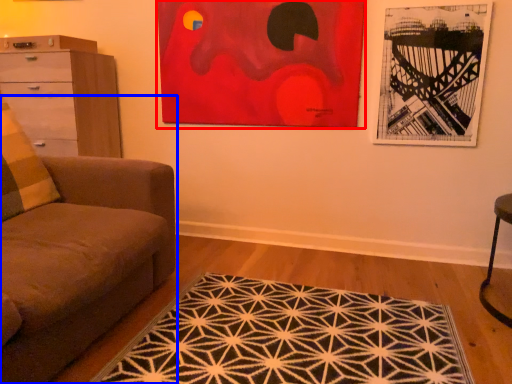
Question: Which object appears farthest to the camera in this image, picture frame (highlighted by a red box) or studio couch (highlighted by a blue box)?

Choices:
 (A) picture frame
 (B) studio couch

Answer: (A)